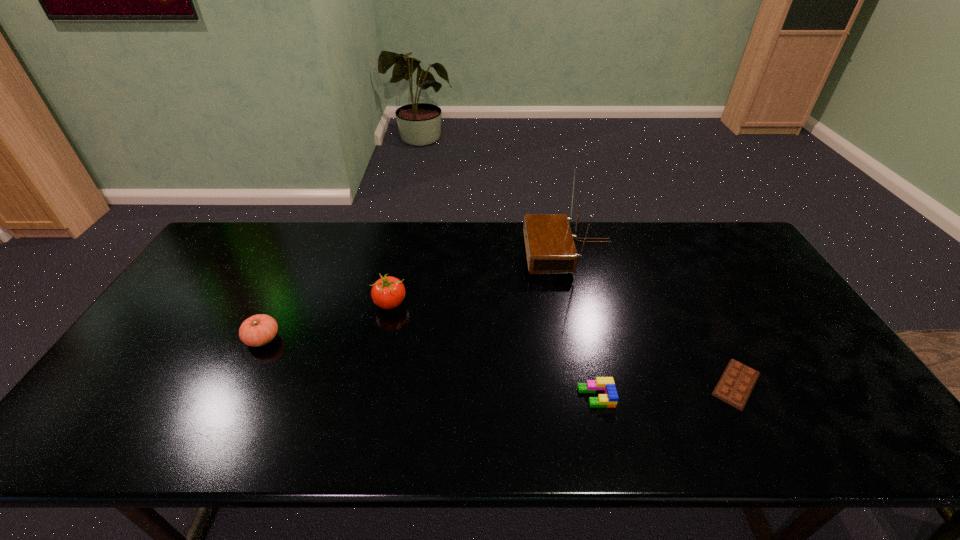
This screenshot has width=960, height=540. Find the location of `vacant space located on the front panel of the farthest object`. vacant space located on the front panel of the farthest object is located at coordinates (478, 252).

Image resolution: width=960 pixels, height=540 pixels. Identify the location of vacant space situated on the front panel of the farthest object. (472, 252).

This screenshot has height=540, width=960. I want to click on vacant space located on the front of the taller tomato, so click(360, 441).

In order to click on vacant space located on the front of the leftmost object in this screenshot , I will do `click(233, 398)`.

The width and height of the screenshot is (960, 540). Find the location of `vacant space located 0.320m on the left of the second shortest object`. vacant space located 0.320m on the left of the second shortest object is located at coordinates (446, 396).

The image size is (960, 540). I want to click on free space located 0.230m on the left of the chocolate bar, so click(613, 384).

Locate an element on the screen. The image size is (960, 540). object located at the far edge is located at coordinates (550, 248).

Identify the location of free space at the far edge of the desktop. Image resolution: width=960 pixels, height=540 pixels. (383, 244).

At what (x,y) coordinates should I click in order to perform the action: click on vacant space at the near edge of the desktop. Please return your answer as a coordinate pair (x, y). Looking at the image, I should click on (521, 442).

The height and width of the screenshot is (540, 960). I want to click on free space at the left edge of the desktop, so click(140, 387).